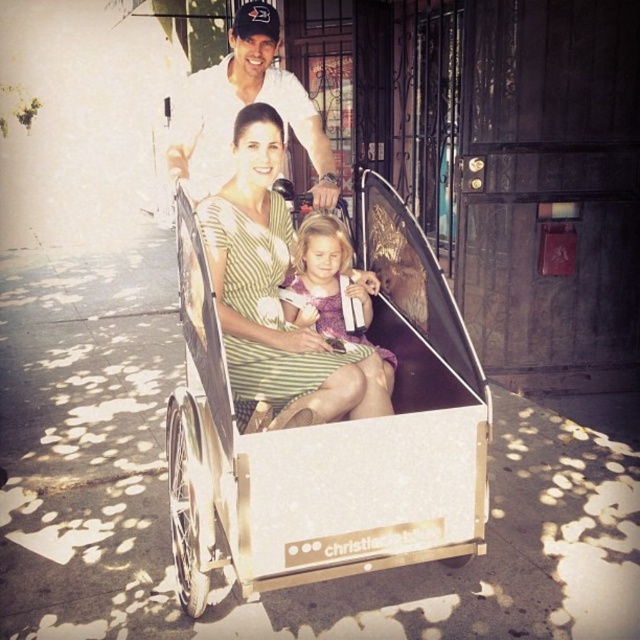
You are a delivery person who needs to place a package on the white metallic wagon at center without disturbing the purple satin dress at center. Given that the package requires 50 centimeters of space, can you fit it between them?

The distance between the white metallic wagon at center and the purple satin dress at center is 47.86 centimeters, which is less than the required 50 centimeters. Therefore, the package cannot be placed between them without moving either object.

You are a photographer trying to capture the family in the scene. You need to position yourself so that the white metallic wagon at center and the purple satin dress at center are both in frame. According to their positions, which object should you place on your left side to ensure both are visible?

You should place the white metallic wagon at center on your left side since it is to the left of the purple satin dress at center, ensuring both are in frame.